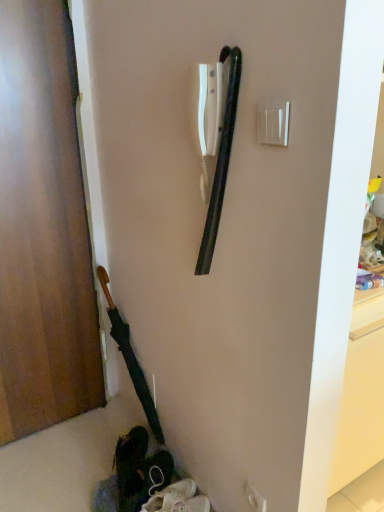
Question: Could you tell me if wooden door at left is turned towards white plastic electric outlet at center?

Choices:
 (A) no
 (B) yes

Answer: (A)

Question: Is wooden door at left shorter than white plastic electric outlet at center?

Choices:
 (A) no
 (B) yes

Answer: (A)

Question: Considering the relative sizes of wooden door at left and white plastic electric outlet at center in the image provided, is wooden door at left bigger than white plastic electric outlet at center?

Choices:
 (A) no
 (B) yes

Answer: (B)

Question: From the image's perspective, is wooden door at left located beneath white plastic electric outlet at center?

Choices:
 (A) no
 (B) yes

Answer: (A)

Question: Is wooden door at left further to camera compared to white plastic electric outlet at center?

Choices:
 (A) no
 (B) yes

Answer: (A)

Question: From a real-world perspective, is wooden door at left physically above white plastic electric outlet at center?

Choices:
 (A) no
 (B) yes

Answer: (B)

Question: Are white plastic electric outlet at center and wooden door at left located far from each other?

Choices:
 (A) yes
 (B) no

Answer: (A)

Question: Is white plastic electric outlet at center directly adjacent to wooden door at left?

Choices:
 (A) no
 (B) yes

Answer: (A)

Question: Is white plastic electric outlet at center oriented towards wooden door at left?

Choices:
 (A) yes
 (B) no

Answer: (B)

Question: Is white plastic electric outlet at center positioned behind wooden door at left?

Choices:
 (A) yes
 (B) no

Answer: (A)

Question: Could wooden door at left be considered to be inside white plastic electric outlet at center?

Choices:
 (A) no
 (B) yes

Answer: (A)

Question: From the image's perspective, is white plastic electric outlet at center beneath wooden door at left?

Choices:
 (A) yes
 (B) no

Answer: (A)

Question: From the image's perspective, is white plastic light switch at upper right on top of wooden door at left?

Choices:
 (A) yes
 (B) no

Answer: (A)